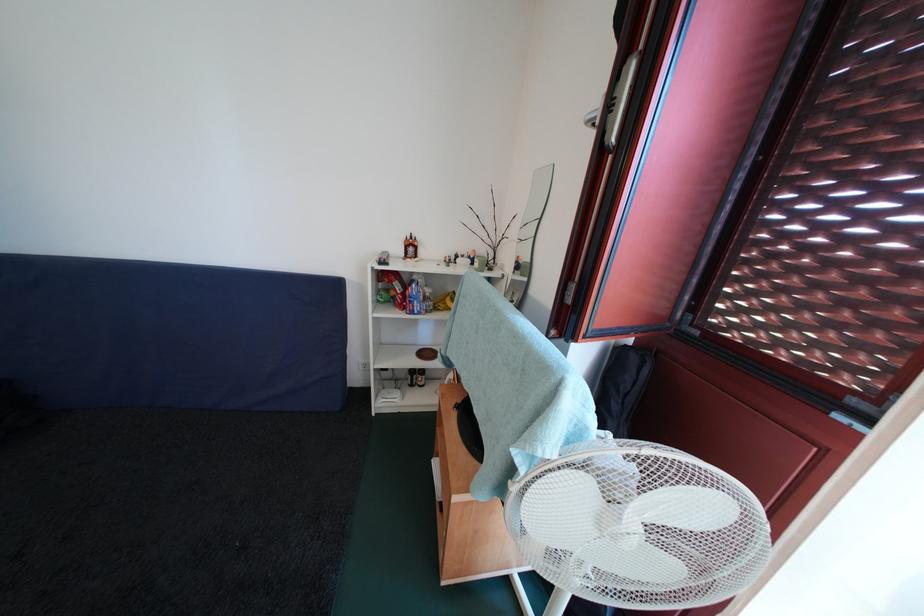
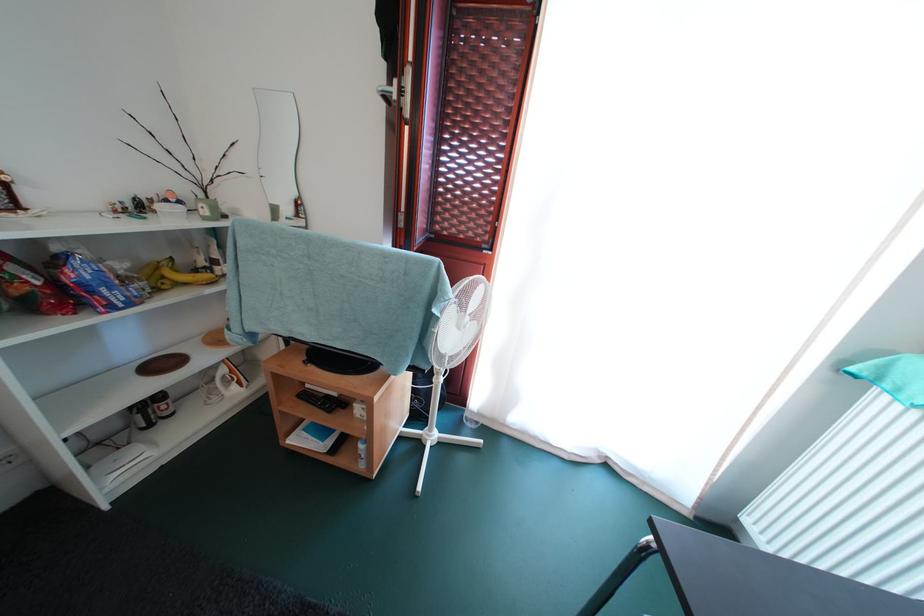
In the second image, find the point that corresponds to [403,296] in the first image.

(34, 286)